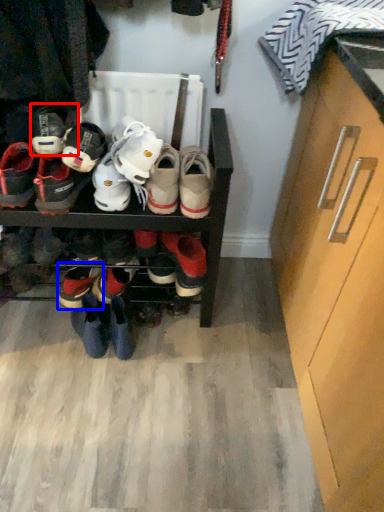
Question: Which point is closer to the camera, footwear (highlighted by a red box) or footwear (highlighted by a blue box)?

Choices:
 (A) footwear
 (B) footwear

Answer: (A)